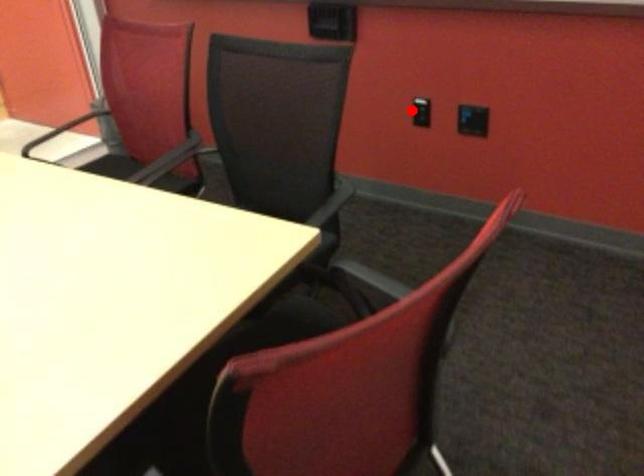
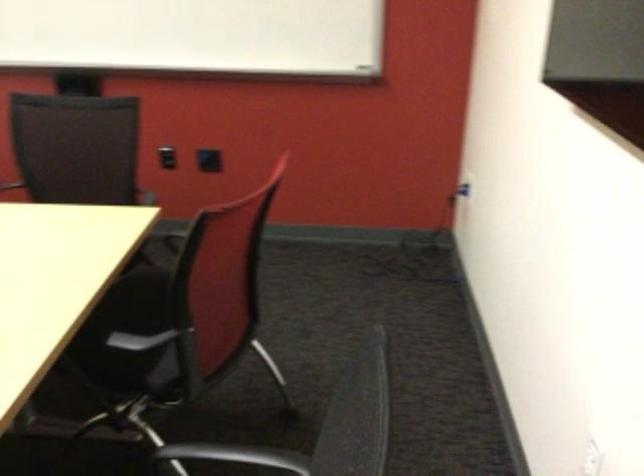
Where in the second image is the point corresponding to the highlighted location from the first image?

(167, 157)